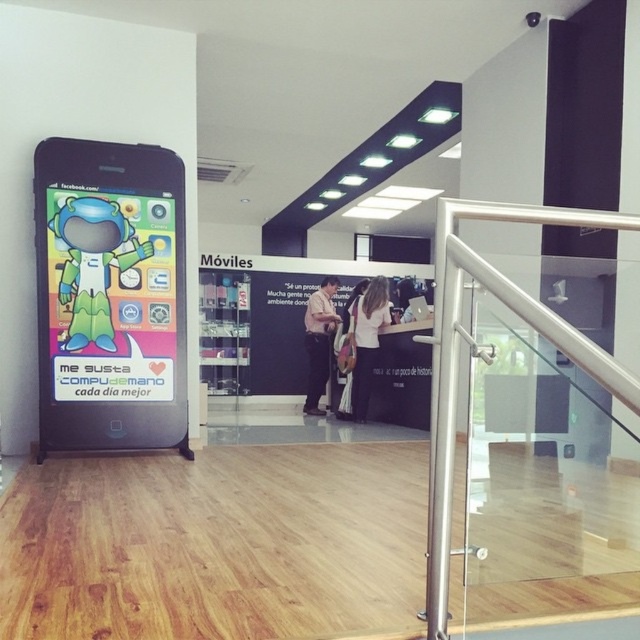
Question: Which point appears farthest from the camera in this image?

Choices:
 (A) (387, 298)
 (B) (448, 449)
 (C) (48, 397)
 (D) (314, 342)

Answer: (D)

Question: Is silver/glass railing at right thinner than white matte shirt at center?

Choices:
 (A) yes
 (B) no

Answer: (B)

Question: Estimate the real-world distances between objects in this image. Which object is farther from the white matte shirt at center?

Choices:
 (A) matte black smartphone at left
 (B) light brown leather shirt at center

Answer: (A)

Question: Considering the real-world distances, which object is farthest from the matte black smartphone at left?

Choices:
 (A) silver/glass railing at right
 (B) white matte shirt at center
 (C) light brown leather shirt at center

Answer: (C)

Question: Does matte black smartphone at left appear on the left side of white matte shirt at center?

Choices:
 (A) no
 (B) yes

Answer: (B)

Question: In this image, where is silver/glass railing at right located relative to white matte shirt at center?

Choices:
 (A) below
 (B) above

Answer: (B)